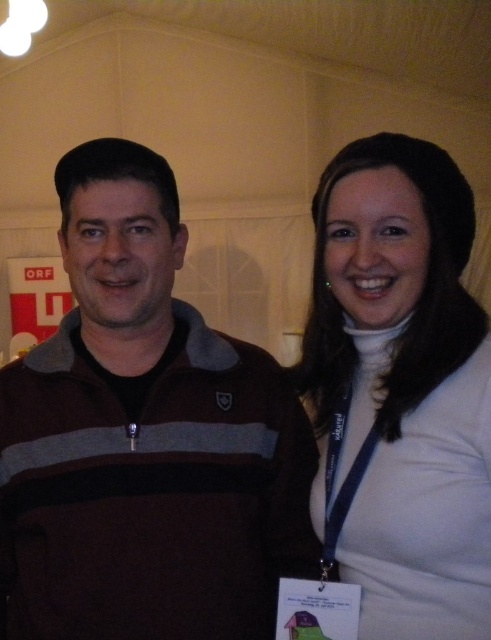
Question: Can you confirm if brown fleece at left is wider than white matte turtleneck at upper right?

Choices:
 (A) yes
 (B) no

Answer: (A)

Question: Does brown fleece at left have a smaller size compared to white matte turtleneck at upper right?

Choices:
 (A) yes
 (B) no

Answer: (B)

Question: Does brown fleece at left have a greater width compared to white matte turtleneck at upper right?

Choices:
 (A) no
 (B) yes

Answer: (B)

Question: Which object appears farthest from the camera in this image?

Choices:
 (A) white matte turtleneck at upper right
 (B) brown fleece at left

Answer: (B)